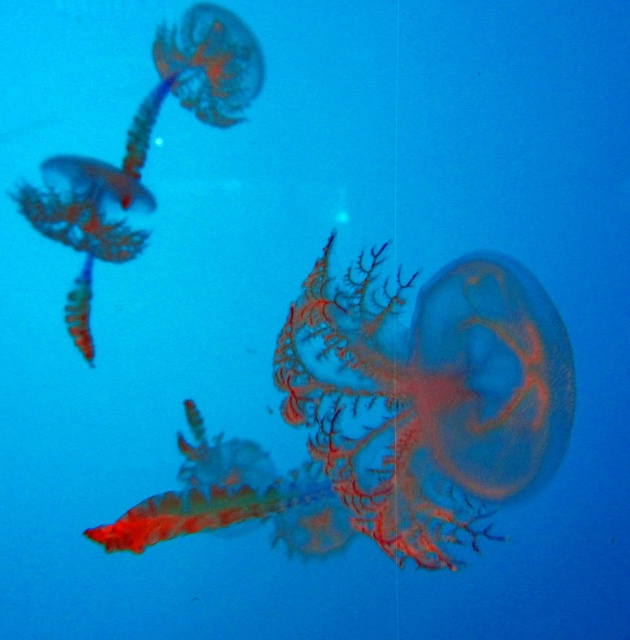
Question: Which point is farther from the camera taking this photo?

Choices:
 (A) (156, 36)
 (B) (423, 346)

Answer: (A)

Question: Which object appears farthest from the camera in this image?

Choices:
 (A) translucent gelatinous at left
 (B) translucent orange jellyfish at center

Answer: (A)

Question: Is translucent orange jellyfish at center below translucent gelatinous at left?

Choices:
 (A) yes
 (B) no

Answer: (A)

Question: Is translucent orange jellyfish at center below translucent gelatinous at left?

Choices:
 (A) yes
 (B) no

Answer: (A)

Question: Can you confirm if translucent orange jellyfish at center is smaller than translucent gelatinous at left?

Choices:
 (A) no
 (B) yes

Answer: (A)